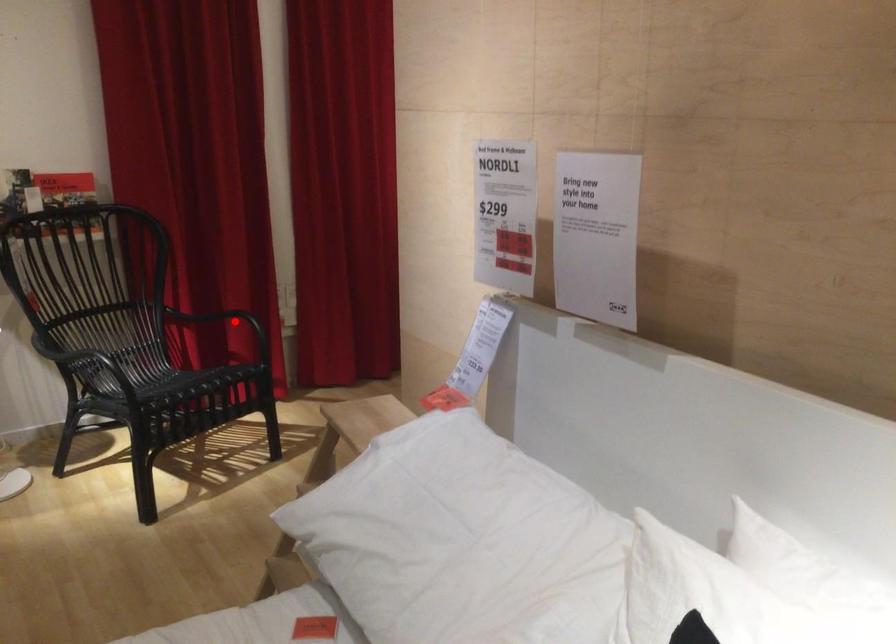
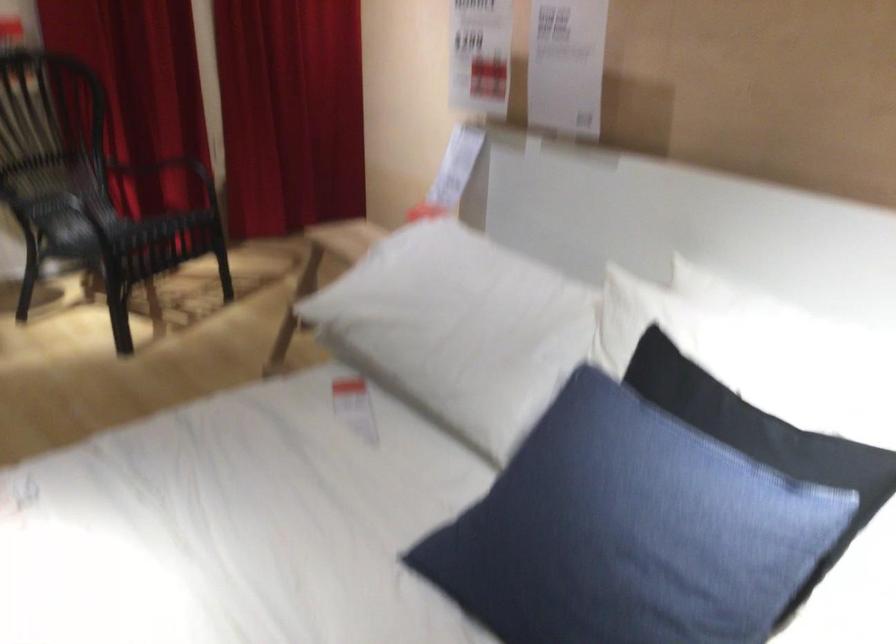
In the second image, find the point that corresponds to the highlighted location in the first image.

(176, 169)